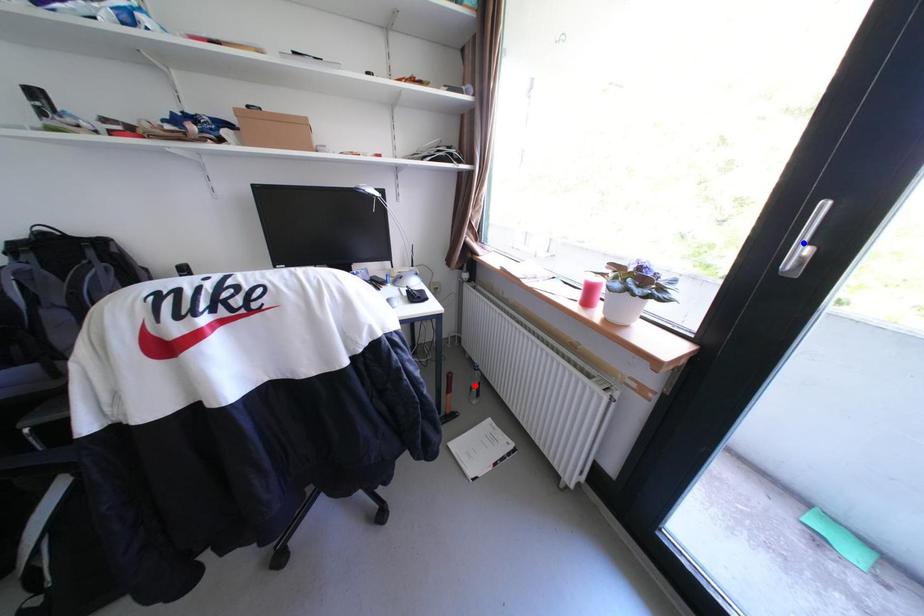
Question: Two points are marked on the image. Which point is closer to the camera?

Choices:
 (A) Blue point is closer.
 (B) Red point is closer.

Answer: (A)